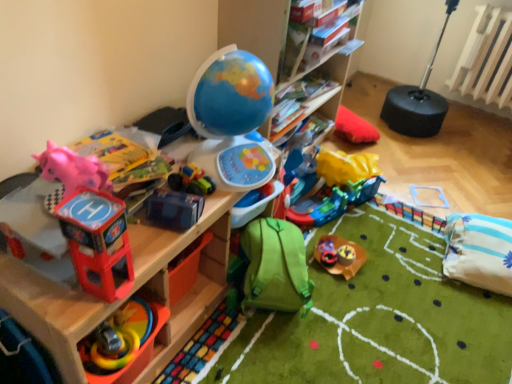
Question: Would you say pink rubber duck at left, which appears as the 9th toy when viewed from the right, is outside green fabric backpack at lower center, which is the sixth toy in left-to-right order?

Choices:
 (A) no
 (B) yes

Answer: (B)

Question: Is pink rubber duck at left, which is the 1th toy from left to right, oriented away from green fabric backpack at lower center, positioned as the fourth toy in right-to-left order?

Choices:
 (A) no
 (B) yes

Answer: (A)

Question: From the image's perspective, is pink rubber duck at left, which appears as the 9th toy when viewed from the right, on green fabric backpack at lower center, positioned as the fourth toy in right-to-left order?

Choices:
 (A) no
 (B) yes

Answer: (B)

Question: Is green fabric backpack at lower center, which is the sixth toy in left-to-right order, a part of pink rubber duck at left, which appears as the 9th toy when viewed from the right?

Choices:
 (A) no
 (B) yes

Answer: (A)

Question: Is pink rubber duck at left, which is the 1th toy from left to right, aimed at green fabric backpack at lower center, positioned as the fourth toy in right-to-left order?

Choices:
 (A) no
 (B) yes

Answer: (A)

Question: Relative to pink rubber duck at left, which appears as the 9th toy when viewed from the right, is white striped pillow at lower right in front or behind?

Choices:
 (A) behind
 (B) front

Answer: (A)

Question: Is white striped pillow at lower right inside or outside of pink rubber duck at left, which appears as the 9th toy when viewed from the right?

Choices:
 (A) inside
 (B) outside

Answer: (B)

Question: Would you say white striped pillow at lower right is to the left or to the right of pink rubber duck at left, which is the 1th toy from left to right, in the picture?

Choices:
 (A) right
 (B) left

Answer: (A)

Question: From a real-world perspective, is white striped pillow at lower right physically located above or below pink rubber duck at left, which is the 1th toy from left to right?

Choices:
 (A) above
 (B) below

Answer: (B)

Question: Choose the correct answer: Is blue plastic toy at center, which ranks as the sixth toy in right-to-left order, inside white striped pillow at lower right or outside it?

Choices:
 (A) outside
 (B) inside

Answer: (A)

Question: Is point (162, 206) positioned closer to the camera than point (493, 228)?

Choices:
 (A) farther
 (B) closer

Answer: (B)

Question: Visually, is blue plastic toy at center, which ranks as the sixth toy in right-to-left order, positioned to the left or to the right of white striped pillow at lower right?

Choices:
 (A) left
 (B) right

Answer: (A)

Question: In the image, is blue plastic toy at center, which ranks as the sixth toy in right-to-left order, positioned in front of or behind white striped pillow at lower right?

Choices:
 (A) front
 (B) behind

Answer: (A)

Question: Would you say rubberized plastic toy at lower left, the second toy from the left, is to the left or to the right of green fabric backpack at lower center, which is the sixth toy in left-to-right order, in the picture?

Choices:
 (A) left
 (B) right

Answer: (A)

Question: Does point (159, 321) appear closer or farther from the camera than point (257, 251)?

Choices:
 (A) farther
 (B) closer

Answer: (B)